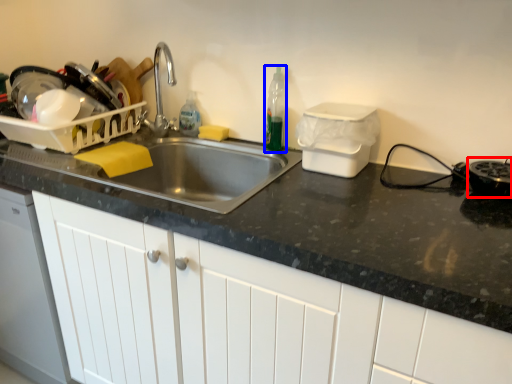
Question: Among these objects, which one is farthest to the camera, appliance (highlighted by a red box) or bottle (highlighted by a blue box)?

Choices:
 (A) appliance
 (B) bottle

Answer: (B)